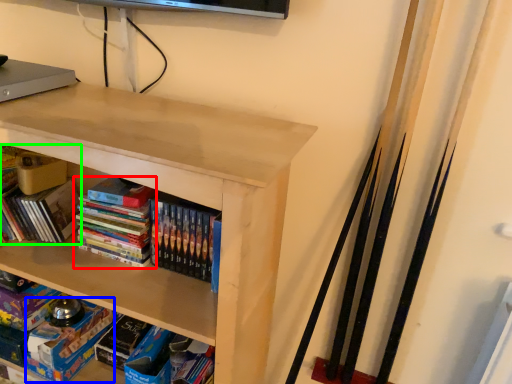
Question: Which is nearer to the book (highlighted by a red box)? paperback book (highlighted by a blue box) or book (highlighted by a green box).

Choices:
 (A) paperback book
 (B) book

Answer: (B)